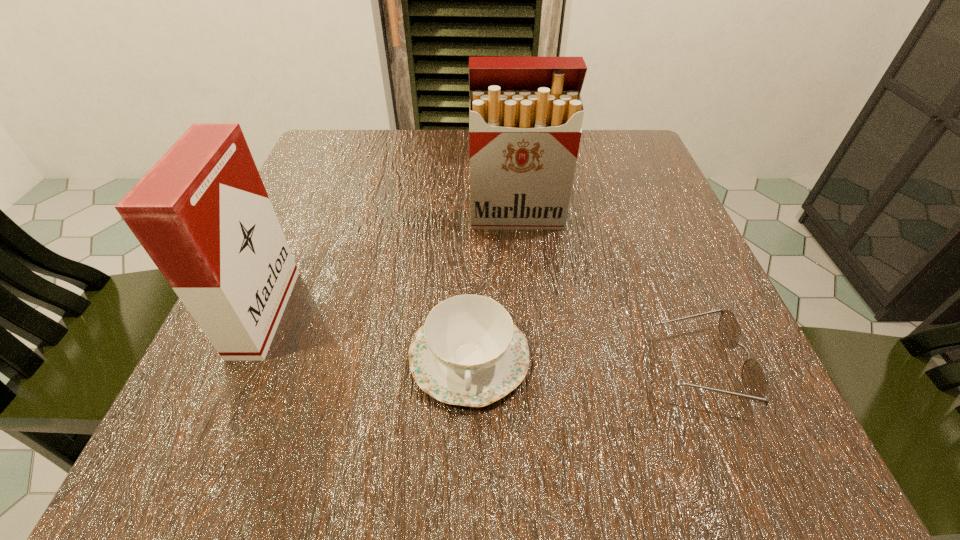
In order to click on the farthest object in this screenshot , I will do `click(525, 114)`.

You are a GUI agent. You are given a task and a screenshot of the screen. Output one action in this format:
    pyautogui.click(x=<x>, y=<y>)
    Task: Click on the right cigarette_case
    This screenshot has width=960, height=540.
    Given the screenshot: What is the action you would take?
    pyautogui.click(x=525, y=114)

In order to click on the left cigarette_case in this screenshot , I will do `click(202, 213)`.

You are a GUI agent. You are given a task and a screenshot of the screen. Output one action in this format:
    pyautogui.click(x=<x>, y=<y>)
    Task: Click on the leftmost object
    The width and height of the screenshot is (960, 540).
    Given the screenshot: What is the action you would take?
    pyautogui.click(x=202, y=213)

The height and width of the screenshot is (540, 960). Identify the location of the third tallest object. (469, 352).

Identify the location of the shortest object. This screenshot has width=960, height=540. (754, 379).

Image resolution: width=960 pixels, height=540 pixels. I want to click on the rightmost object, so click(754, 379).

Where is `vacant region located with the lid open on the right cigarette_case`? vacant region located with the lid open on the right cigarette_case is located at coordinates (522, 278).

The height and width of the screenshot is (540, 960). Identify the location of vacant region located 0.400m on the front-facing side of the left cigarette_case. (552, 313).

At what (x,y) coordinates should I click in order to perform the action: click on free space located on the handle side of the third tallest object. Please return your answer as a coordinate pair (x, y). This screenshot has width=960, height=540. Looking at the image, I should click on (468, 461).